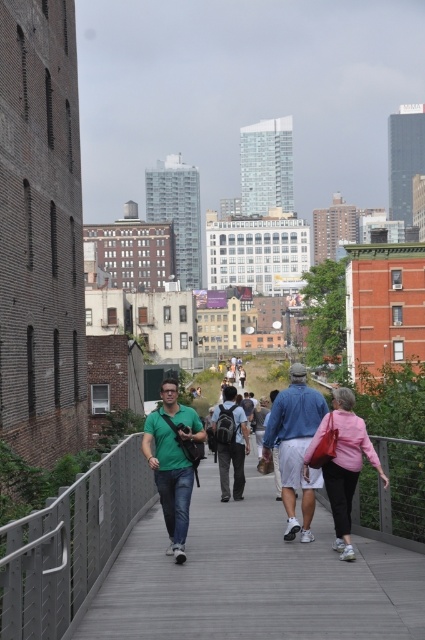
Between denim shorts at center and pink fabric jacket at center, which one appears on the left side from the viewer's perspective?

denim shorts at center

Is denim shorts at center below pink fabric jacket at center?

Indeed, denim shorts at center is positioned under pink fabric jacket at center.

Where is `denim shorts at center`? This screenshot has width=425, height=640. denim shorts at center is located at coordinates (295, 445).

Who is more forward, (192, 472) or (351, 460)?

Positioned in front is point (351, 460).

Locate an element on the screen. The height and width of the screenshot is (640, 425). green matte shirt at center is located at coordinates coord(172,461).

Between wooden at center and dark blue backpack at center, which one is positioned higher?

wooden at center is above.

Which of these two, wooden at center or dark blue backpack at center, stands taller?

With more height is dark blue backpack at center.

The width and height of the screenshot is (425, 640). Find the location of `wooden at center`. wooden at center is located at coordinates (255, 577).

You are a GUI agent. You are given a task and a screenshot of the screen. Output one action in this format:
    pyautogui.click(x=<x>, y=<y>)
    Task: Click on the wooden at center
    The image size is (425, 640).
    Given the screenshot: What is the action you would take?
    pyautogui.click(x=255, y=577)